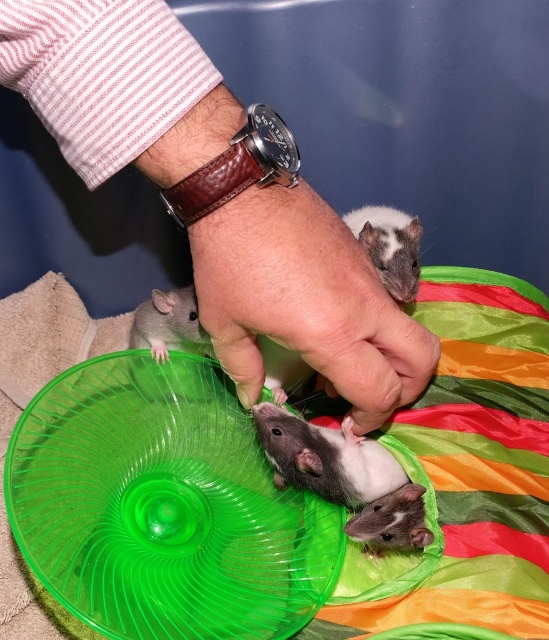
Does white matte mouse at center have a greater height compared to light brown fur mouse at center?

Indeed, white matte mouse at center has a greater height compared to light brown fur mouse at center.

Consider the image. Between white matte mouse at center and light brown fur mouse at center, which one appears on the right side from the viewer's perspective?

From the viewer's perspective, white matte mouse at center appears more on the right side.

Image resolution: width=549 pixels, height=640 pixels. I want to click on white matte mouse at center, so click(389, 246).

Can you confirm if white matte mouse at center is shorter than white glossy mouse at center?

In fact, white matte mouse at center may be taller than white glossy mouse at center.

Is white matte mouse at center to the left of white glossy mouse at center from the viewer's perspective?

No, white matte mouse at center is not to the left of white glossy mouse at center.

Who is more forward, (368, 208) or (389, 502)?

Point (389, 502) is more forward.

Locate an element on the screen. white matte mouse at center is located at coordinates (389, 246).

Is gray-furred hamster at center positioned before white glossy mouse at center?

No, it is behind white glossy mouse at center.

Between point (277, 468) and point (418, 504), which one is positioned behind?

The point (277, 468) is more distant.

Where is `gray-furred hamster at center`? This screenshot has height=640, width=549. gray-furred hamster at center is located at coordinates (324, 458).